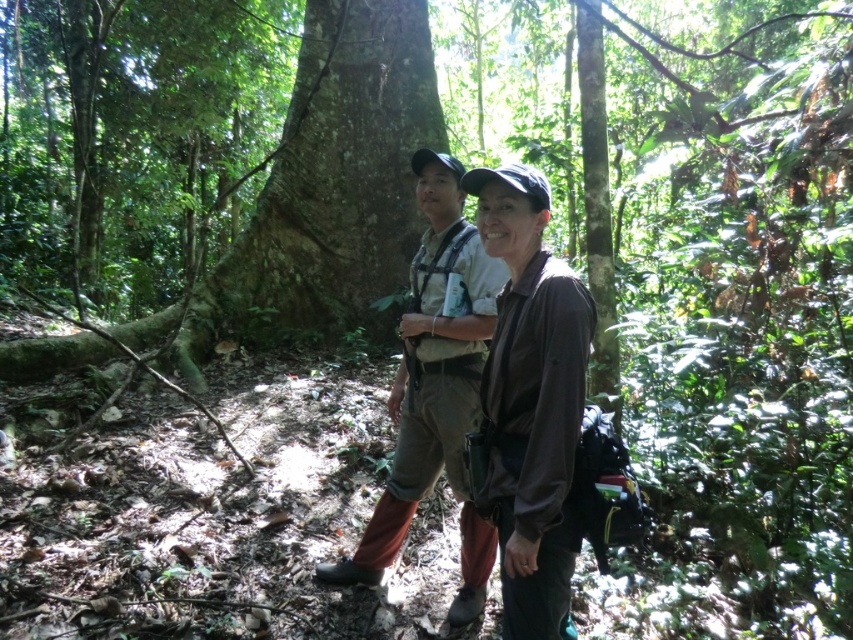
You are a hiker trying to take a photo of the brown matte shirt at center without the green rough bark tree at center blocking the view. Can you move to the left or right side of the tree to get a clear shot?

The green rough bark tree at center is taller than the brown matte shirt at center, so moving to either the left or right side of the tree would allow you to position yourself below the tree where its height won not block the view of the brown matte shirt at center.

You are navigating through a dense forest and come across two landmarks marked by coordinates. The first is at point [561,524] and the second at point [389,396]. If you are facing the direction of travel, which coordinate point is closer to your current position?

Point [561,524] is in front of point [389,396], so the coordinate point [561,524] is closer to your current position when facing the direction of travel.